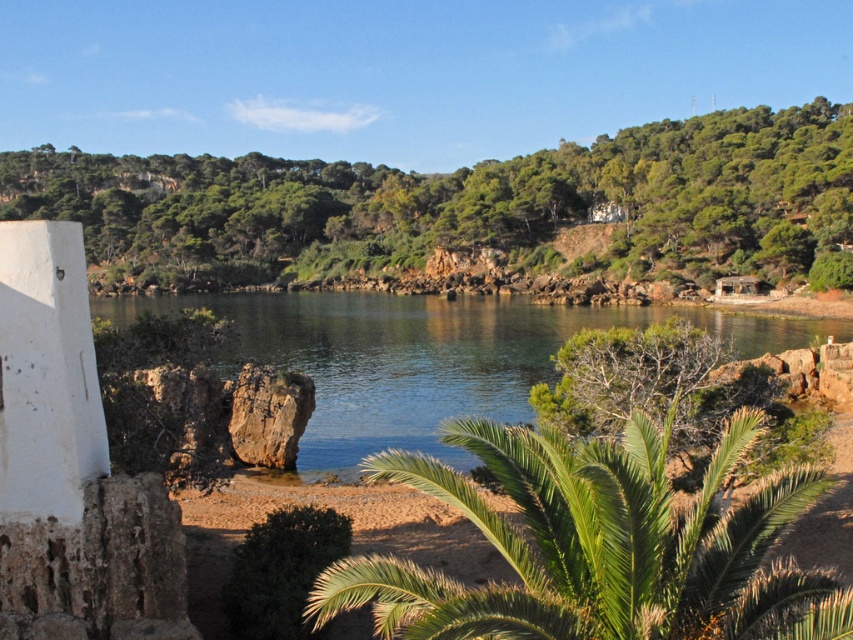
Question: Where is green leafy palm tree at center located in relation to clear water at center in the image?

Choices:
 (A) below
 (B) above

Answer: (A)

Question: Can you confirm if green leafy palm tree at center is positioned to the right of clear water at center?

Choices:
 (A) no
 (B) yes

Answer: (B)

Question: Considering the relative positions of green leafy palm tree at center and clear water at center in the image provided, where is green leafy palm tree at center located with respect to clear water at center?

Choices:
 (A) left
 (B) right

Answer: (B)

Question: Which of the following is the farthest from the observer?

Choices:
 (A) (527, 412)
 (B) (527, 522)

Answer: (A)